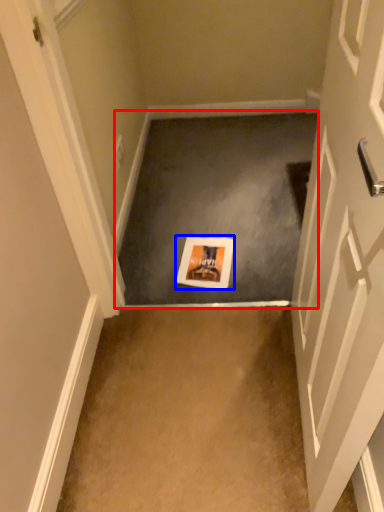
Question: Which object appears closest to the camera in this image, concrete (highlighted by a red box) or postcard (highlighted by a blue box)?

Choices:
 (A) concrete
 (B) postcard

Answer: (A)